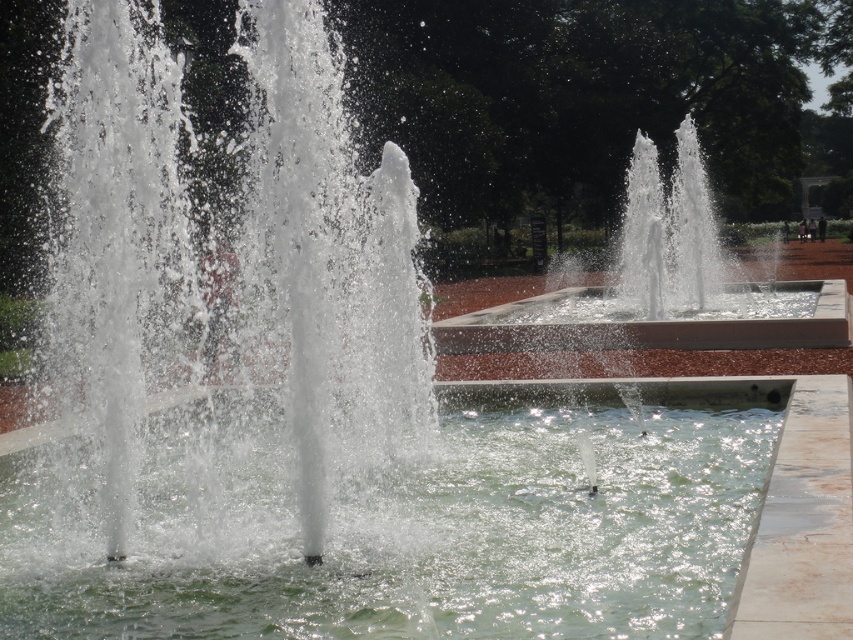
Is clear liquid water at center shorter than white glossy water at center?

Correct, clear liquid water at center is not as tall as white glossy water at center.

Does clear liquid water at center appear over white glossy water at center?

Actually, clear liquid water at center is below white glossy water at center.

Is point (664, 493) closer to viewer compared to point (701, 173)?

Yes.

Where is `clear liquid water at center`? This screenshot has width=853, height=640. clear liquid water at center is located at coordinates (407, 524).